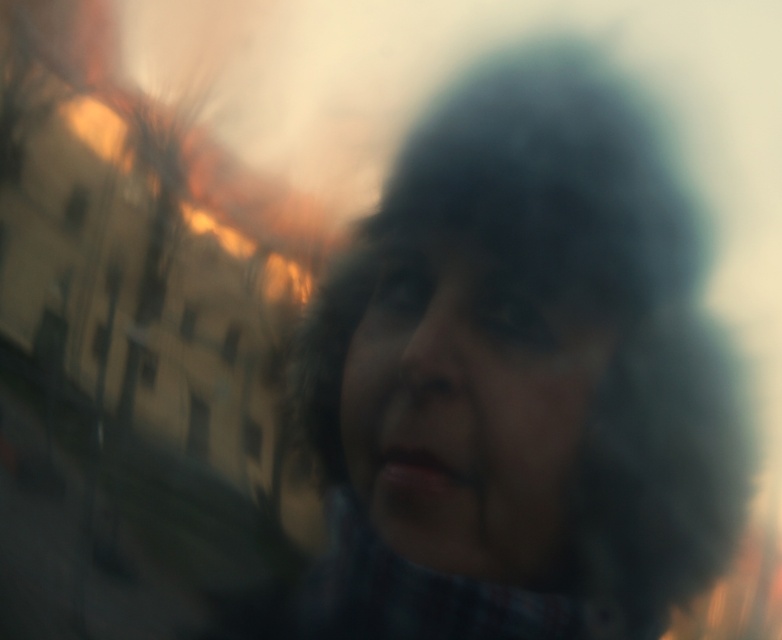
Does dark hair at center have a greater width compared to smooth skin face at center?

Indeed, dark hair at center has a greater width compared to smooth skin face at center.

Is point (457, 488) more distant than point (542, 356)?

No.

The width and height of the screenshot is (782, 640). What are the coordinates of `dark hair at center` in the screenshot? It's located at (519, 380).